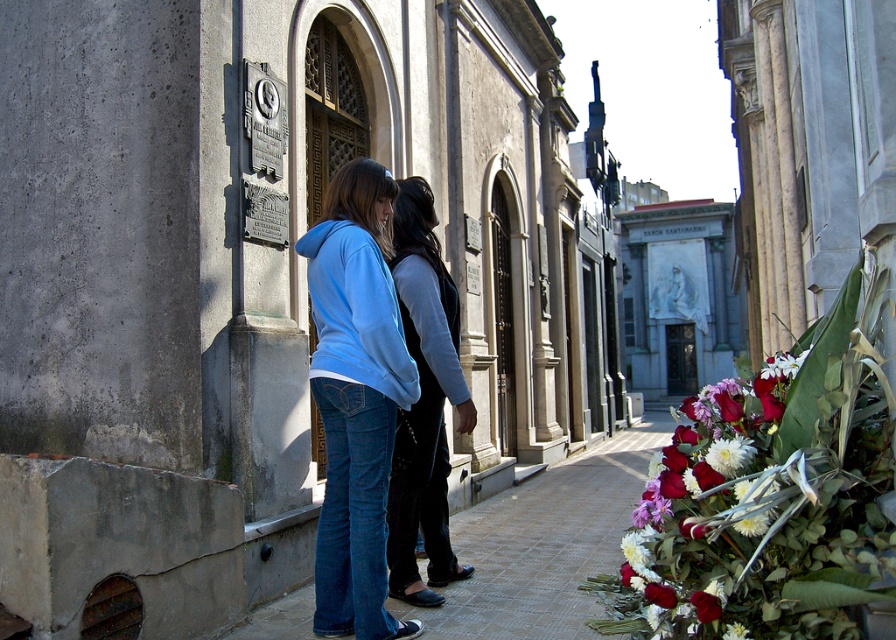
Question: Which point is farther from the camera taking this photo?

Choices:
 (A) (390, 312)
 (B) (349, 600)

Answer: (B)

Question: From the image, what is the correct spatial relationship of light blue hoodie at center in relation to black leather jacket at center?

Choices:
 (A) right
 (B) left

Answer: (B)

Question: Can you confirm if light blue hoodie at center is thinner than vivid red petals at lower right?

Choices:
 (A) no
 (B) yes

Answer: (B)

Question: Which object is positioned closest to the light blue hoodie at center?

Choices:
 (A) denim jeans at center
 (B) black leather jacket at center
 (C) vivid red petals at lower right

Answer: (B)

Question: Can you confirm if light blue hoodie at center is bigger than vivid red petals at lower right?

Choices:
 (A) yes
 (B) no

Answer: (B)

Question: Which of these objects is positioned closest to the light blue hoodie at center?

Choices:
 (A) matte blue hoodie at center
 (B) black leather jacket at center

Answer: (A)